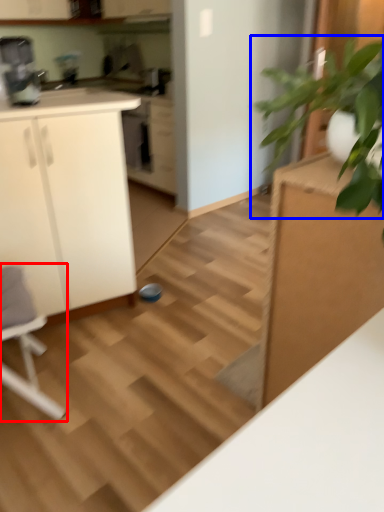
Question: Which of the following is the farthest to the observer, rocking chair (highlighted by a red box) or houseplant (highlighted by a blue box)?

Choices:
 (A) rocking chair
 (B) houseplant

Answer: (A)